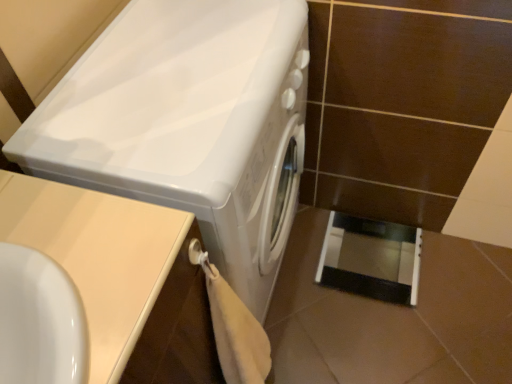
Question: Considering the positions of beige laminate counter top at lower left and black glossy screen door at lower right in the image, is beige laminate counter top at lower left taller or shorter than black glossy screen door at lower right?

Choices:
 (A) tall
 (B) short

Answer: (A)

Question: Based on their positions, is beige laminate counter top at lower left located to the left or right of black glossy screen door at lower right?

Choices:
 (A) left
 (B) right

Answer: (A)

Question: Which of these objects is positioned farthest from the black glossy screen door at lower right?

Choices:
 (A) white glossy washing machine at center
 (B) beige laminate counter top at lower left

Answer: (B)

Question: Based on their relative distances, which object is nearer to the black glossy screen door at lower right?

Choices:
 (A) beige laminate counter top at lower left
 (B) white glossy washing machine at center

Answer: (B)